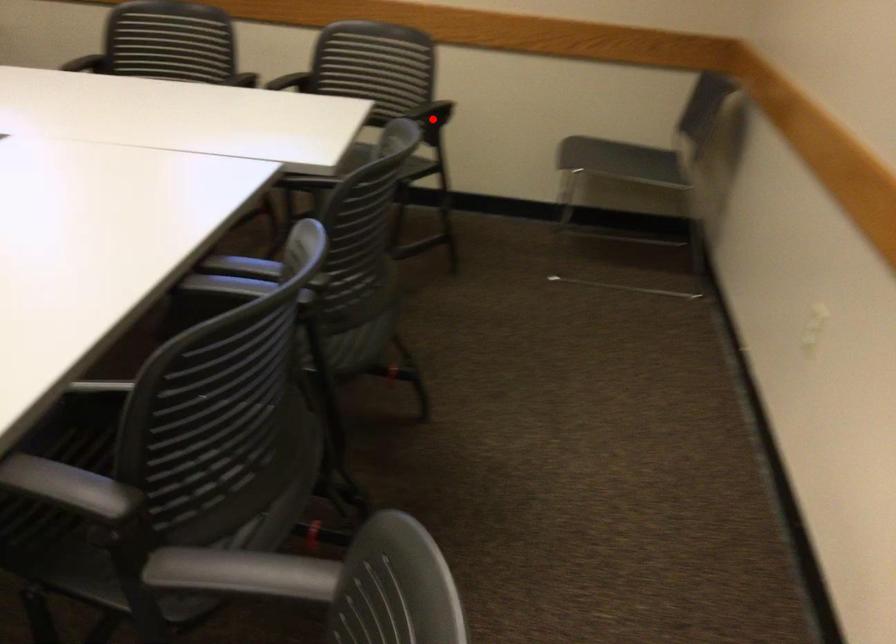
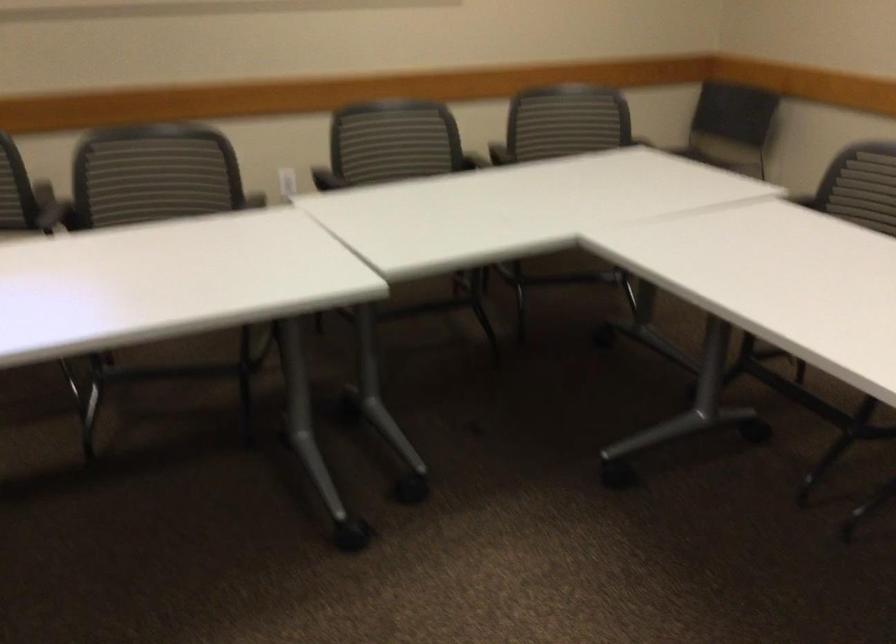
Question: I am providing you with two images of the same scene from different viewpoints. A red point is marked on the first image. Is the red point's position out of view in image 2?

Choices:
 (A) Yes
 (B) No

Answer: (A)